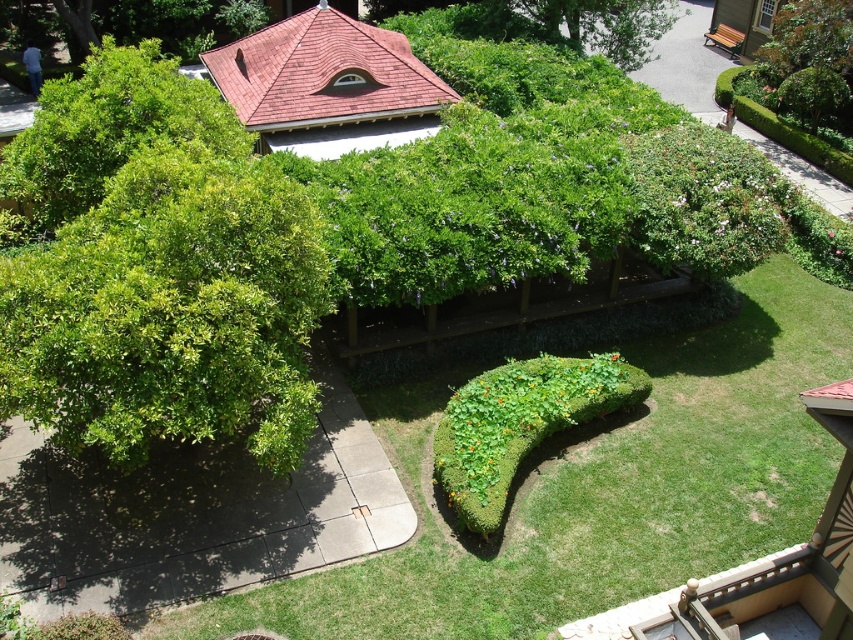
Based on the photo, is green leafy bush at upper right below green leafy bush at upper center?

Indeed, green leafy bush at upper right is positioned under green leafy bush at upper center.

From the picture: Does green leafy bush at upper right have a greater height compared to green leafy bush at upper center?

Yes.

At what (x,y) coordinates should I click in order to perform the action: click on green leafy bush at upper right. Please return your answer as a coordinate pair (x, y). This screenshot has width=853, height=640. Looking at the image, I should click on (808, 58).

Is point (100, 65) positioned after point (637, 400)?

Yes.

This screenshot has width=853, height=640. What do you see at coordinates (109, 129) in the screenshot? I see `green leafy bush at upper left` at bounding box center [109, 129].

Where is `green leafy bush at upper left`? green leafy bush at upper left is located at coordinates (x=109, y=129).

Does green leafy bush at upper left have a lesser width compared to green leafy bush at upper right?

Incorrect, green leafy bush at upper left's width is not less than green leafy bush at upper right's.

Can you confirm if green leafy bush at upper left is wider than green leafy bush at upper right?

Indeed, green leafy bush at upper left has a greater width compared to green leafy bush at upper right.

Does point (7, 164) lie behind point (811, 76)?

No, (7, 164) is in front of (811, 76).

Where is `green leafy bush at upper left`? The width and height of the screenshot is (853, 640). green leafy bush at upper left is located at coordinates (109, 129).